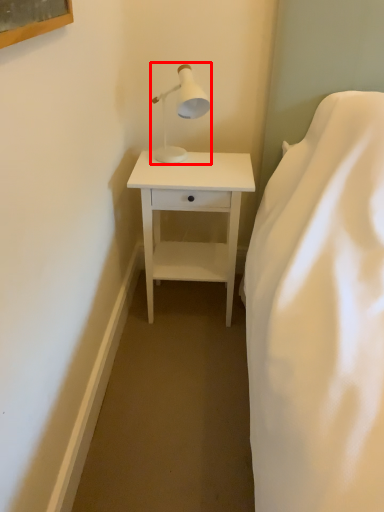
Question: From the image's perspective, where is table lamp (annotated by the red box) located in relation to nightstand in the image?

Choices:
 (A) above
 (B) below

Answer: (A)